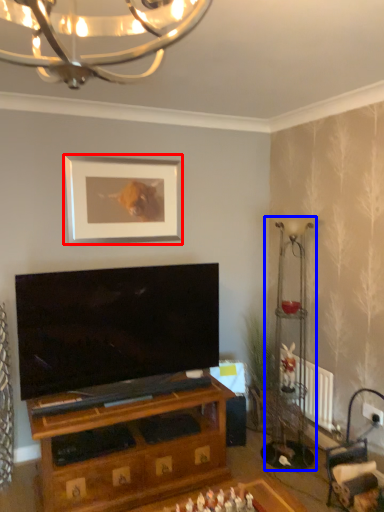
Question: Which of the following is the farthest to the observer, picture frame (highlighted by a red box) or lamp (highlighted by a blue box)?

Choices:
 (A) picture frame
 (B) lamp

Answer: (A)